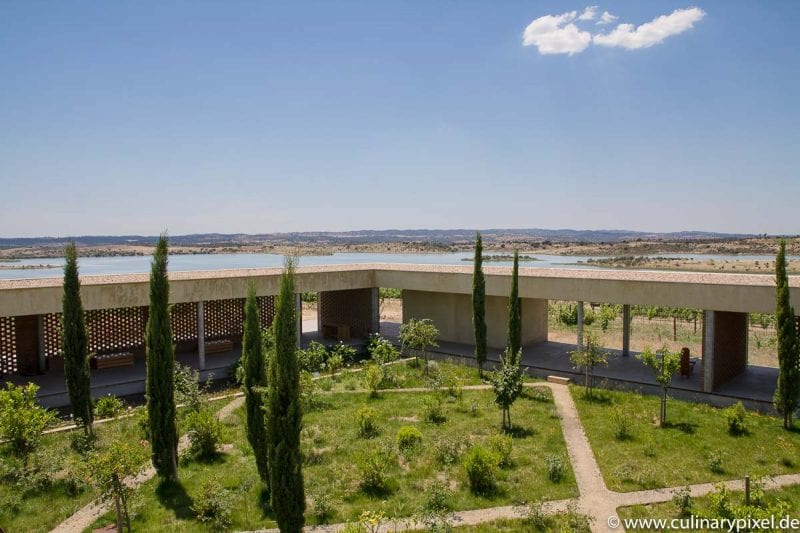
This screenshot has height=533, width=800. What are the coordinates of `seat` in the screenshot? It's located at (684, 361).